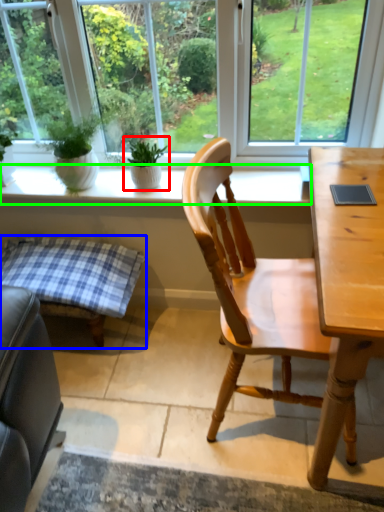
Question: Which object is the farthest from houseplant (highlighted by a red box)? Choose among these: table (highlighted by a blue box) or window sill (highlighted by a green box).

Choices:
 (A) table
 (B) window sill

Answer: (A)